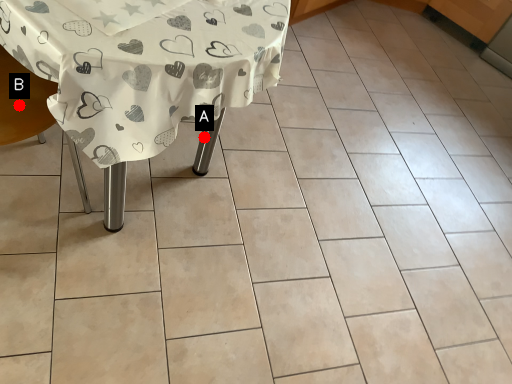
Question: Two points are circled on the image, labeled by A and B beside each circle. Which point is closer to the camera taking this photo?

Choices:
 (A) A is closer
 (B) B is closer

Answer: (B)